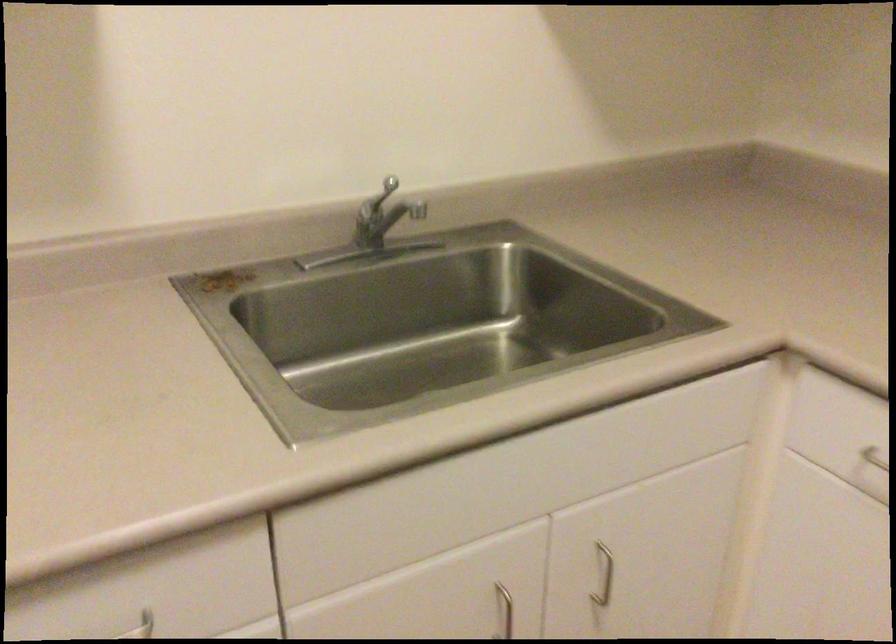
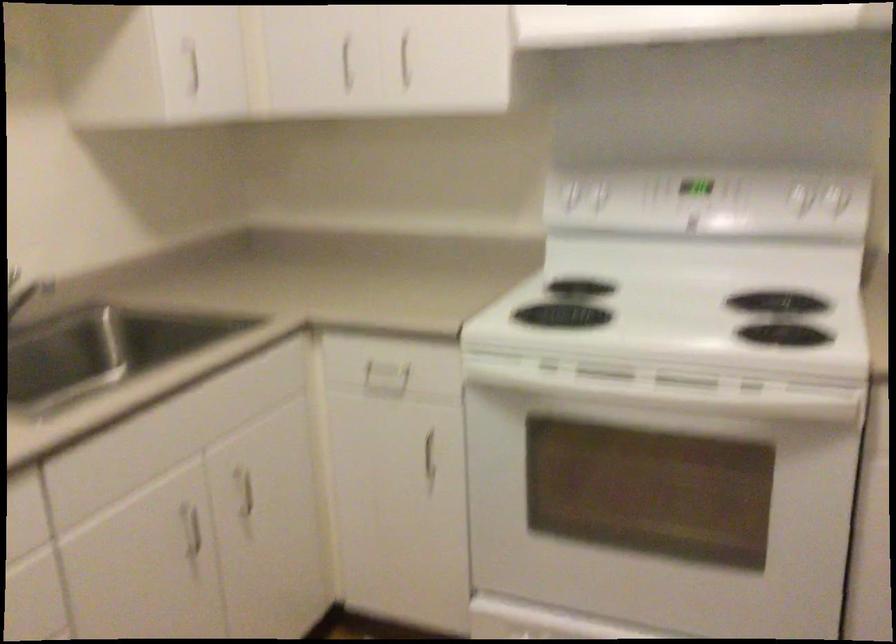
Question: The camera is either moving clockwise (left) or counter-clockwise (right) around the object. The first image is from the beginning of the video and the second image is from the end. Is the camera moving left or right when shooting the video?

Choices:
 (A) Left
 (B) Right

Answer: (A)